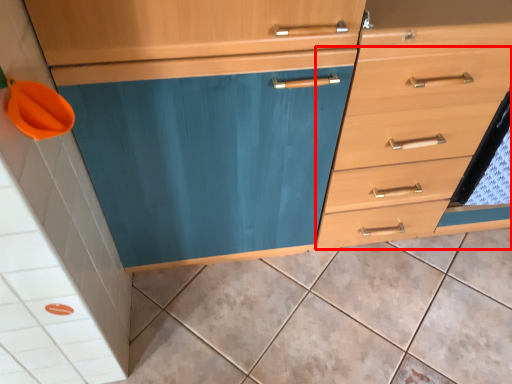
Question: In this image, where is drawer (annotated by the red box) located relative to ceramic tile?

Choices:
 (A) left
 (B) right

Answer: (B)